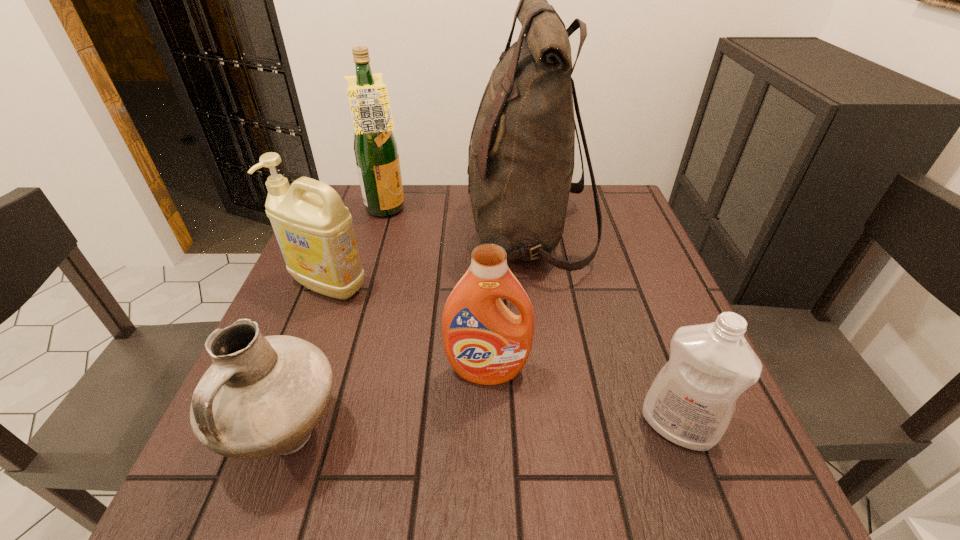
Where is `blank area located on the open flap of the tallest object`? blank area located on the open flap of the tallest object is located at coordinates (319, 233).

This screenshot has height=540, width=960. Find the location of `vacant region located 0.240m on the front-facing side of the liquor`. vacant region located 0.240m on the front-facing side of the liquor is located at coordinates (494, 211).

This screenshot has height=540, width=960. Identify the location of vacant area situated 0.390m on the back of the farthest detergent. (368, 184).

Locate an element on the screen. This screenshot has width=960, height=540. free space located on the front-facing side of the fourth farthest object is located at coordinates (490, 500).

The image size is (960, 540). What are the coordinates of `free region located on the left of the nearest detergent` in the screenshot? It's located at (564, 426).

Locate an element on the screen. This screenshot has height=540, width=960. backpack located at the far edge is located at coordinates (521, 154).

The width and height of the screenshot is (960, 540). Identify the location of liquor positioned at the far edge. (375, 147).

Locate an element on the screen. The height and width of the screenshot is (540, 960). object that is at the near edge is located at coordinates (262, 396).

Locate an element on the screen. The width and height of the screenshot is (960, 540). liquor that is at the left edge is located at coordinates (375, 147).

Find the location of a particular element. This screenshot has width=960, height=540. detergent that is at the left edge is located at coordinates point(314,230).